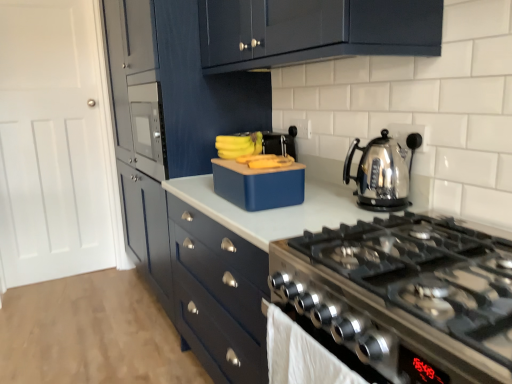
You are a GUI agent. You are given a task and a screenshot of the screen. Output one action in this format:
    pyautogui.click(x=<x>, y=<y>)
    Task: Click on the free point above blue matte lunchbox at center (from a real-world perspective)
    The image size is (512, 384).
    Given the screenshot: What is the action you would take?
    pyautogui.click(x=256, y=157)